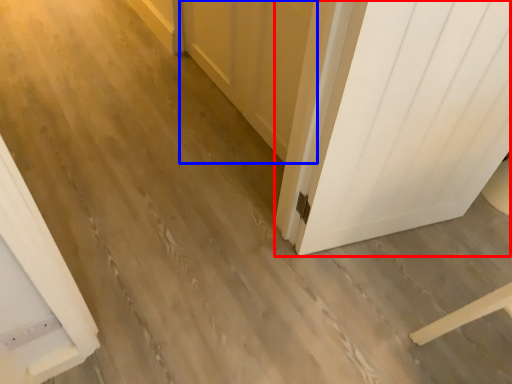
Question: Which object appears closest to the camera in this image, door (highlighted by a red box) or barn door (highlighted by a blue box)?

Choices:
 (A) door
 (B) barn door

Answer: (A)